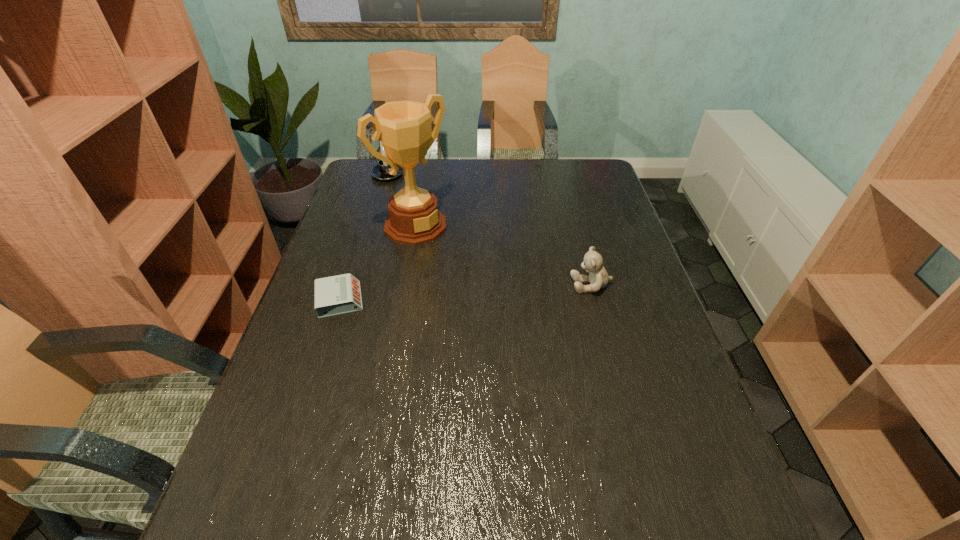
I want to click on vacant spot on the desktop that is between the alarm clock and the teddy bear and is positioned with a handle on the side of the farthest object, so click(x=475, y=292).

Identify the location of vacant space on the desktop that is between the shortest object and the rightmost object and is positioned on the front-facing side of the second farthest object. (495, 291).